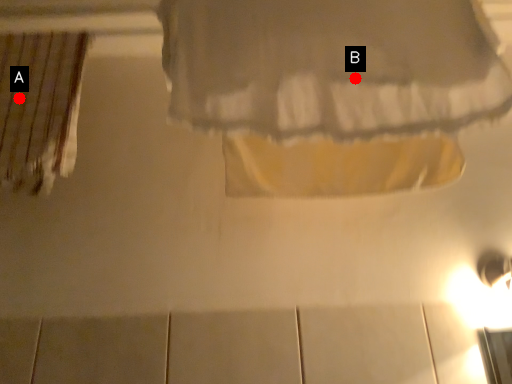
Question: Two points are circled on the image, labeled by A and B beside each circle. Which point appears farthest from the camera in this image?

Choices:
 (A) A is further
 (B) B is further

Answer: (A)